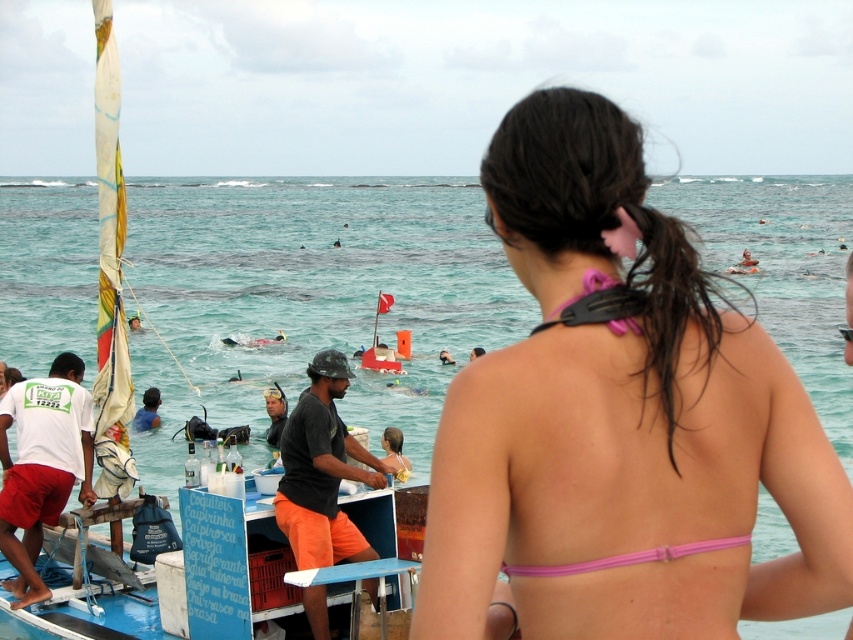
Who is shorter, pink fabric bikini top at upper right or pink fabric bikini at center?

pink fabric bikini at center

The image size is (853, 640). Identify the location of pink fabric bikini top at upper right. (619, 417).

Where is `pink fabric bikini top at upper right`? pink fabric bikini top at upper right is located at coordinates (619, 417).

Is point (448, 497) behind point (746, 541)?

No, it is not.

Is pink fabric bikini top at upper right shorter than pink fabric bikini at back?

Incorrect, pink fabric bikini top at upper right's height does not fall short of pink fabric bikini at back's.

Locate an element on the screen. This screenshot has height=640, width=853. pink fabric bikini top at upper right is located at coordinates (619, 417).

Does point (340, 545) come farther from viewer compared to point (579, 323)?

That is True.

Who is more distant from viewer, (317, 435) or (611, 285)?

Point (317, 435)

Identify the location of black matte helmet at center. (322, 472).